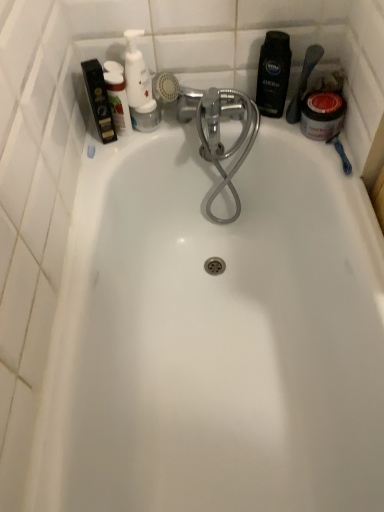
Question: Is the depth of matte black jar at upper right greater than that of white glossy pump bottle at upper left, the 3th toiletry viewed from the right?

Choices:
 (A) no
 (B) yes

Answer: (B)

Question: Are matte black jar at upper right and white glossy pump bottle at upper left, acting as the 1th toiletry starting from the left, far apart?

Choices:
 (A) no
 (B) yes

Answer: (A)

Question: Can white glossy pump bottle at upper left, acting as the 1th toiletry starting from the left, be found inside matte black jar at upper right?

Choices:
 (A) no
 (B) yes

Answer: (A)

Question: From a real-world perspective, does matte black jar at upper right stand above white glossy pump bottle at upper left, acting as the 1th toiletry starting from the left?

Choices:
 (A) no
 (B) yes

Answer: (A)

Question: Does matte black jar at upper right have a lesser width compared to white glossy pump bottle at upper left, the 3th toiletry viewed from the right?

Choices:
 (A) no
 (B) yes

Answer: (A)

Question: Do you think matte black jar at upper right is within white glossy pump bottle at upper left, the 3th toiletry viewed from the right, or outside of it?

Choices:
 (A) outside
 (B) inside

Answer: (A)

Question: Considering the relative positions of matte black jar at upper right and white glossy pump bottle at upper left, the 3th toiletry viewed from the right, in the image provided, is matte black jar at upper right to the left or to the right of white glossy pump bottle at upper left, the 3th toiletry viewed from the right,?

Choices:
 (A) left
 (B) right

Answer: (B)

Question: Looking at the image, does matte black jar at upper right seem bigger or smaller compared to white glossy pump bottle at upper left, the 3th toiletry viewed from the right?

Choices:
 (A) big
 (B) small

Answer: (A)

Question: Looking at their shapes, would you say matte black jar at upper right is wider or thinner than white glossy pump bottle at upper left, acting as the 1th toiletry starting from the left?

Choices:
 (A) wide
 (B) thin

Answer: (A)

Question: Based on their sizes in the image, would you say matte black jar at upper right is bigger or smaller than white glossy pump bottle at upper left, which is counted as the second toiletry, starting from the left?

Choices:
 (A) small
 (B) big

Answer: (A)

Question: Is matte black jar at upper right wider or thinner than white glossy pump bottle at upper left, which is counted as the 2th toiletry, starting from the right?

Choices:
 (A) wide
 (B) thin

Answer: (B)

Question: From the image's perspective, relative to white glossy pump bottle at upper left, which is counted as the second toiletry, starting from the left, is matte black jar at upper right above or below?

Choices:
 (A) below
 (B) above

Answer: (A)

Question: Considering the positions of matte black jar at upper right and white glossy pump bottle at upper left, which is counted as the 2th toiletry, starting from the right, in the image, is matte black jar at upper right taller or shorter than white glossy pump bottle at upper left, which is counted as the 2th toiletry, starting from the right,?

Choices:
 (A) tall
 (B) short

Answer: (B)

Question: In terms of size, does white glossy pump bottle at upper left, which is counted as the 2th toiletry, starting from the right, appear bigger or smaller than white glossy pump bottle at upper left, acting as the 1th toiletry starting from the left?

Choices:
 (A) small
 (B) big

Answer: (B)

Question: Is white glossy pump bottle at upper left, which is counted as the 2th toiletry, starting from the right, inside the boundaries of white glossy pump bottle at upper left, the 3th toiletry viewed from the right, or outside?

Choices:
 (A) inside
 (B) outside

Answer: (B)